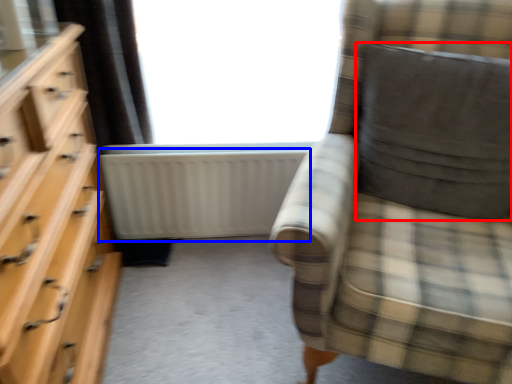
Question: Which point is further to the camera, pillow (highlighted by a red box) or radiator (highlighted by a blue box)?

Choices:
 (A) pillow
 (B) radiator

Answer: (B)